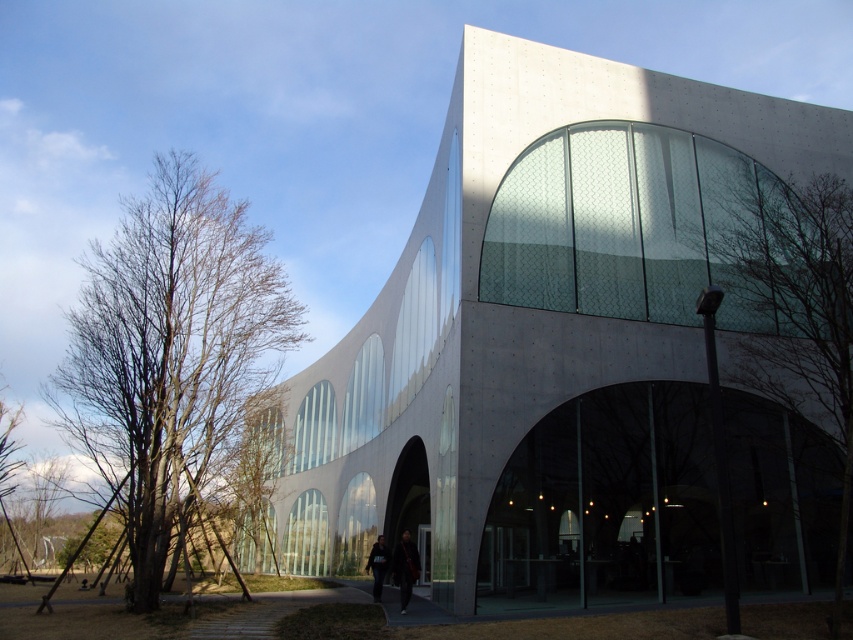
Question: Among these objects, which one is nearest to the camera?

Choices:
 (A) green leafless tree at right
 (B) dark gray fabric jacket at center
 (C) dark gray jacket at center
 (D) white concrete building at center

Answer: (A)

Question: Based on their relative distances, which object is farther from the dark gray jacket at center?

Choices:
 (A) white concrete building at center
 (B) green leafless tree at right
 (C) bare wood tree at left

Answer: (C)

Question: Does white concrete building at center appear over dark gray jacket at center?

Choices:
 (A) yes
 (B) no

Answer: (A)

Question: Can you confirm if white concrete building at center is positioned above green leafless tree at right?

Choices:
 (A) no
 (B) yes

Answer: (A)

Question: Which point appears farthest from the camera in this image?

Choices:
 (A) (70, 419)
 (B) (380, 580)
 (C) (410, 547)
 (D) (549, 404)

Answer: (A)

Question: Is white concrete building at center bigger than dark gray fabric jacket at center?

Choices:
 (A) no
 (B) yes

Answer: (B)